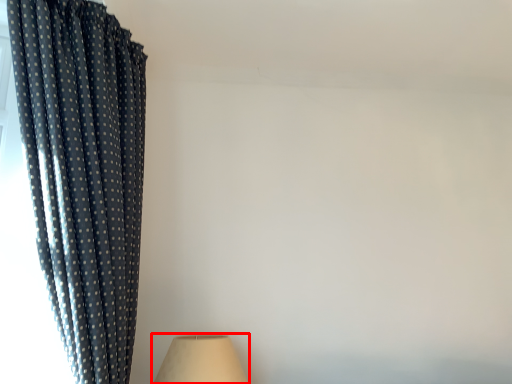
Question: Considering the relative positions of lamp (annotated by the red box) and curtain in the image provided, where is lamp (annotated by the red box) located with respect to the staircase?

Choices:
 (A) right
 (B) left

Answer: (A)